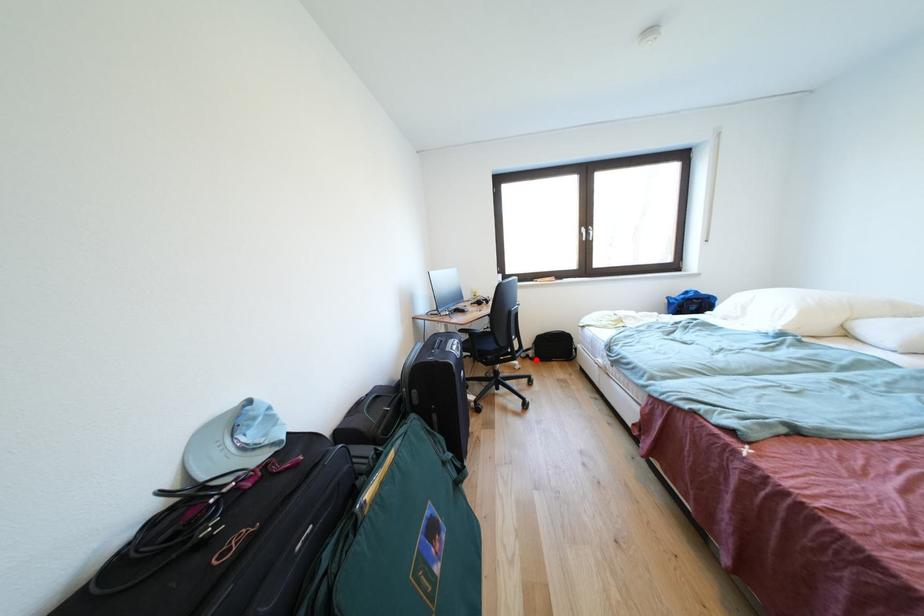
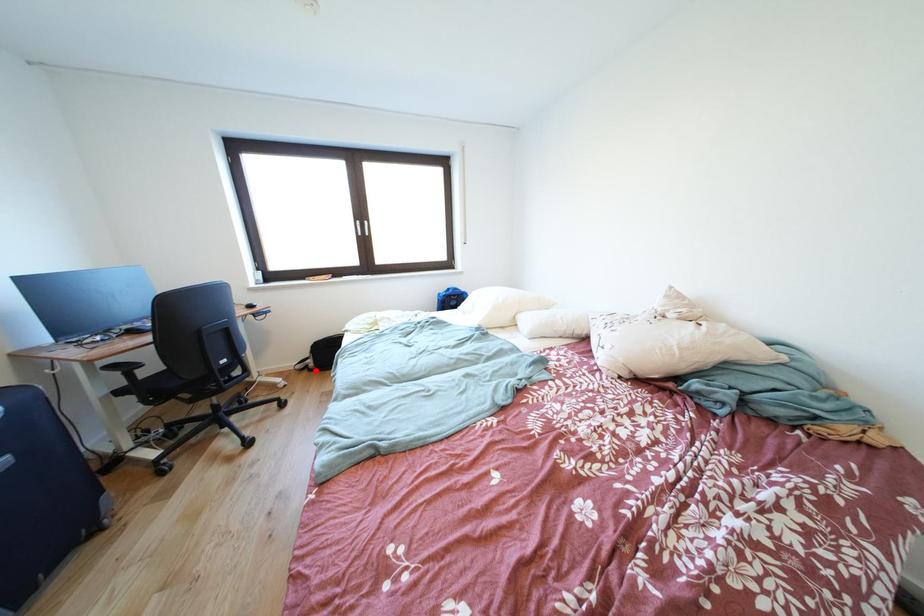
I am providing you with two images of the same scene from different viewpoints. A red point is marked on the first image and another point is marked on the second image. Does the point marked in image1 correspond to the same location as the one in image2?

Yes